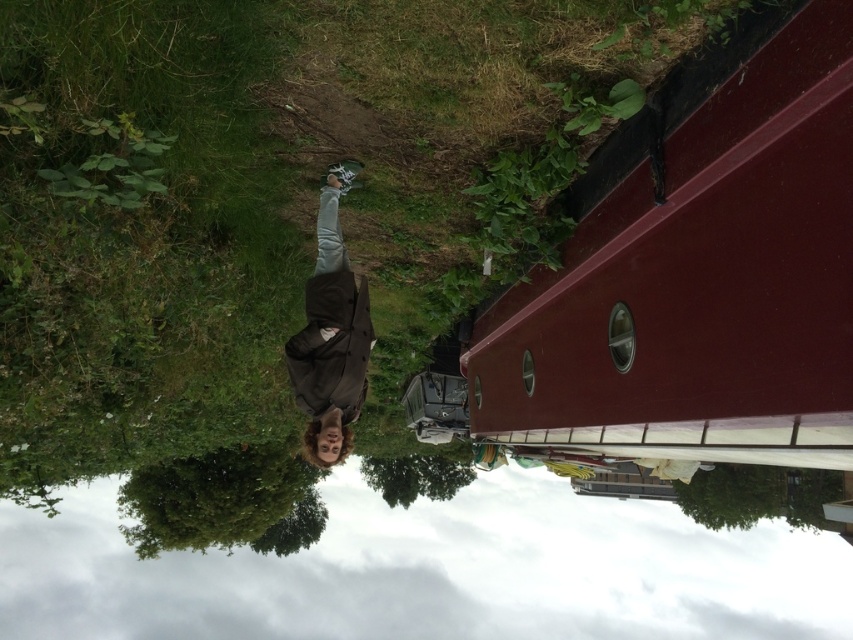
You are a photographer trying to capture the maroon smooth boat at upper right and the transparent plastic water at lower center in a single frame. Given the scene has been rotated 90 degrees clockwise, which object would require you to adjust your camera angle more to include its full width in the photo?

The transparent plastic water at lower center requires more adjustment since it is wider than the maroon smooth boat at upper right, as the maroon smooth boat at upper right is narrower.